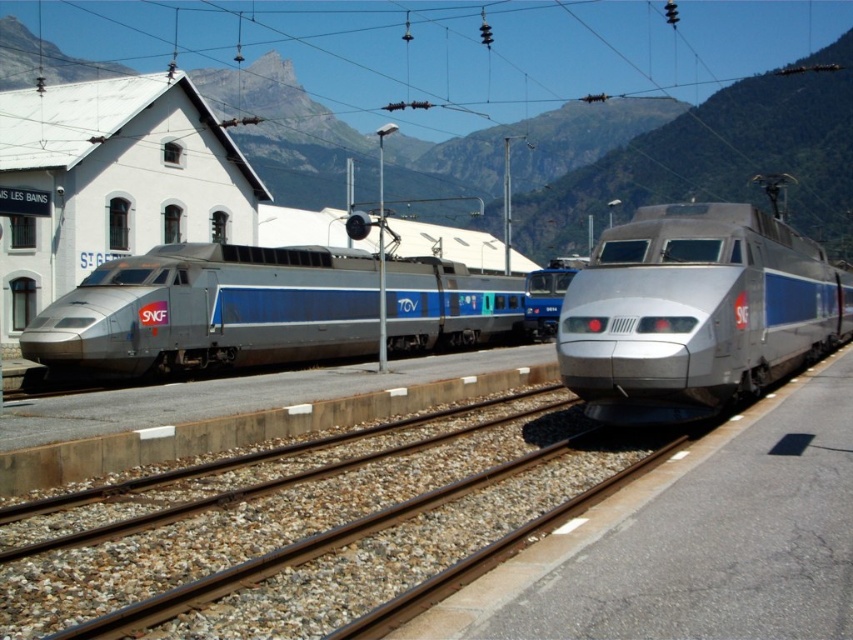
Does metallic silver train at center come in front of silver metallic bullet train at center?

No, metallic silver train at center is further to the viewer.

Between metallic silver train at center and silver metallic bullet train at center, which one has more height?

With more height is metallic silver train at center.

Is point (196, 342) closer to camera compared to point (722, 332)?

No, (196, 342) is further to viewer.

Identify the location of metallic silver train at center. Image resolution: width=853 pixels, height=640 pixels. (209, 310).